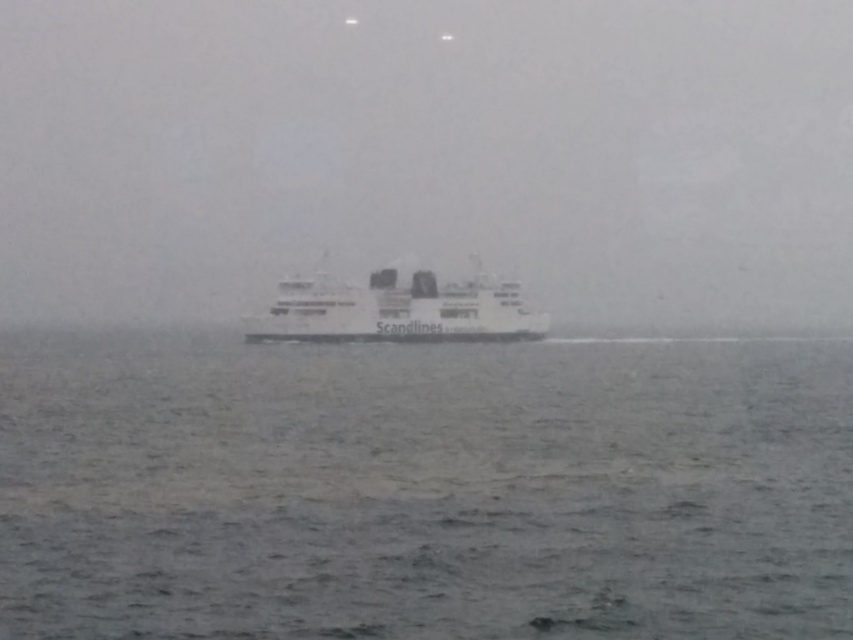
Question: Observing the image, what is the correct spatial positioning of white matte fog at center in reference to white matte ferry at center?

Choices:
 (A) right
 (B) left

Answer: (B)

Question: Which is farther from the white matte ferry at center?

Choices:
 (A) gray matte water at center
 (B) white matte fog at center

Answer: (B)

Question: Is gray matte water at center below white matte ferry at center?

Choices:
 (A) yes
 (B) no

Answer: (A)

Question: Which object is closer to the camera taking this photo?

Choices:
 (A) gray matte water at center
 (B) white matte ferry at center

Answer: (A)

Question: Considering the relative positions of white matte fog at center and gray matte water at center in the image provided, where is white matte fog at center located with respect to gray matte water at center?

Choices:
 (A) below
 (B) above

Answer: (B)

Question: Which of the following is the farthest from the observer?

Choices:
 (A) (196, 209)
 (B) (427, 388)

Answer: (A)